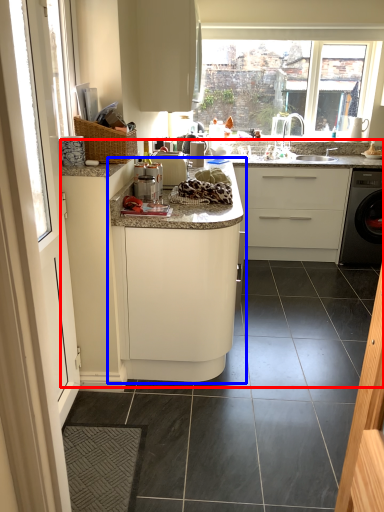
Question: Which point is further to the camera, counter top (highlighted by a red box) or cabinetry (highlighted by a blue box)?

Choices:
 (A) counter top
 (B) cabinetry

Answer: (B)